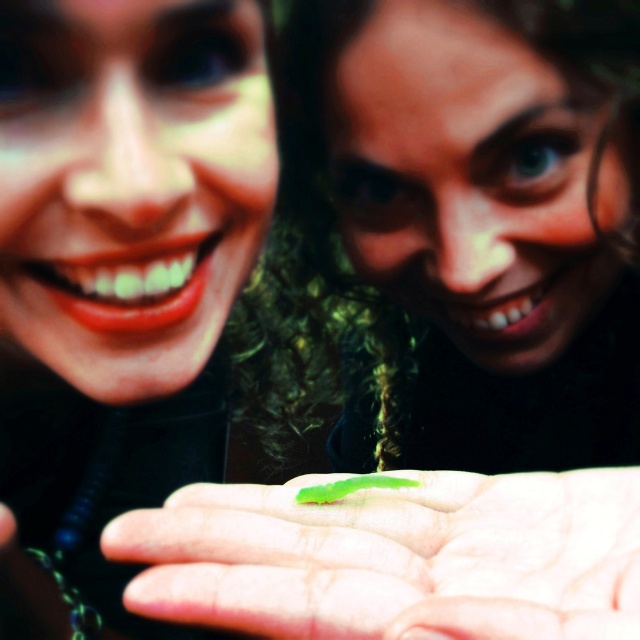
Looking at this image, can you confirm if green rubber worm at center is smaller than green matte caterpillar at center?

Incorrect, green rubber worm at center is not smaller in size than green matte caterpillar at center.

You are a GUI agent. You are given a task and a screenshot of the screen. Output one action in this format:
    pyautogui.click(x=<x>, y=<y>)
    Task: Click on the green rubber worm at center
    This screenshot has height=640, width=640.
    Given the screenshot: What is the action you would take?
    pyautogui.click(x=394, y=557)